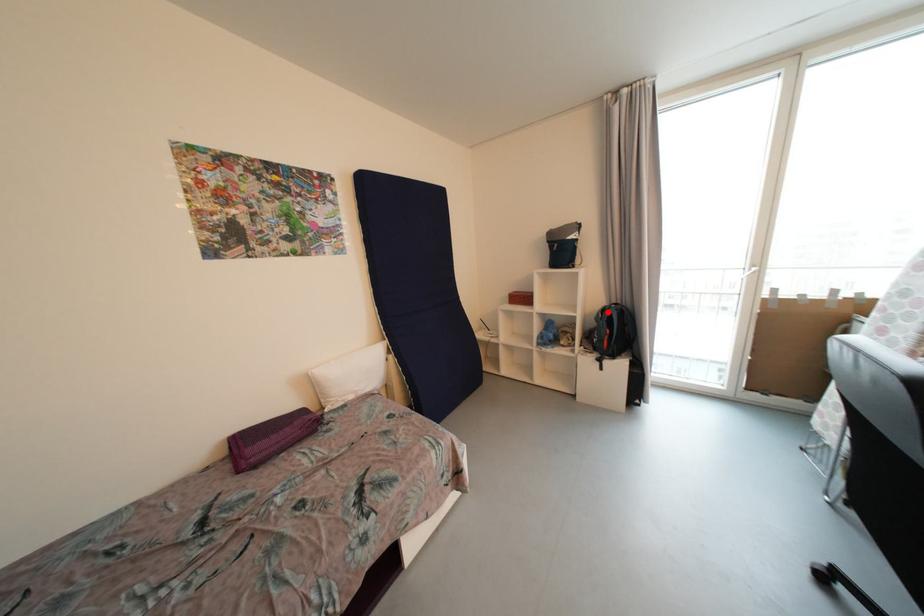
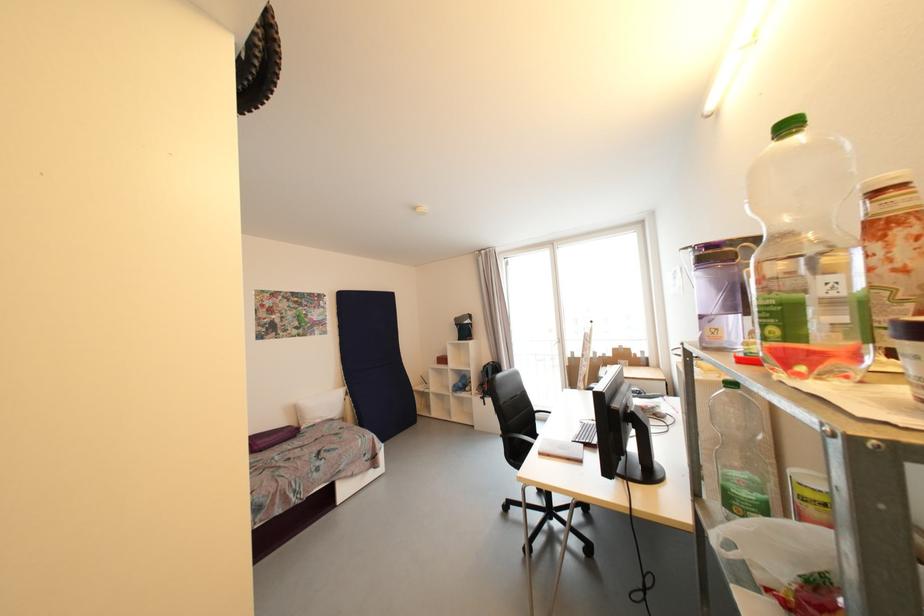
Question: I am providing you with two images of the same scene from different viewpoints. A red point is marked on the first image. At the location where the point appears in image 1, is it still visible in image 2?

Choices:
 (A) Yes
 (B) No

Answer: (A)